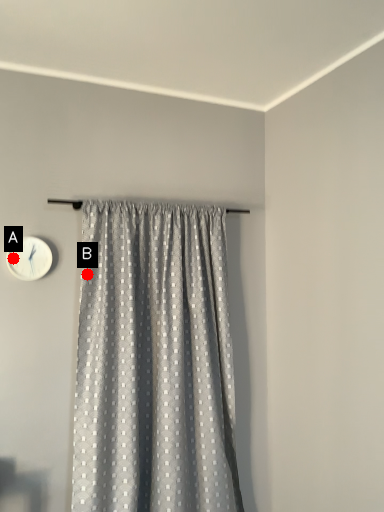
Question: Two points are circled on the image, labeled by A and B beside each circle. Which point is further to the camera?

Choices:
 (A) A is further
 (B) B is further

Answer: (B)